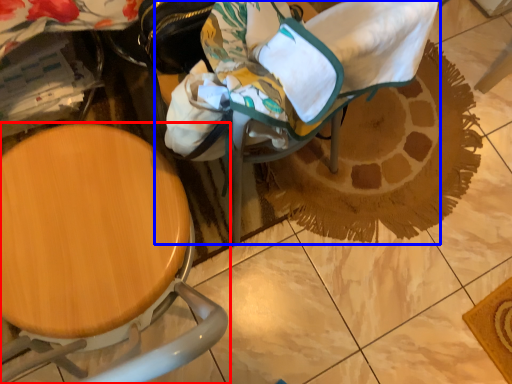
Question: Which of the following is the farthest to the observer, chair (highlighted by a red box) or baby carriage (highlighted by a blue box)?

Choices:
 (A) chair
 (B) baby carriage

Answer: (B)